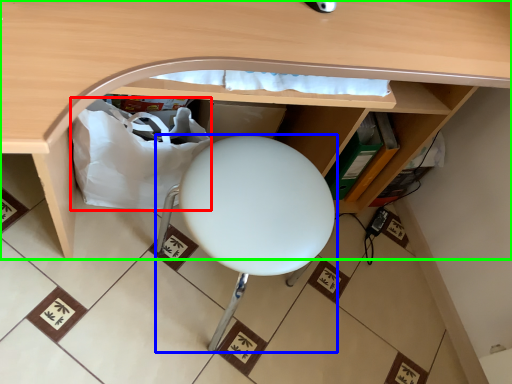
Question: Based on their relative distances, which object is farther from paper bag (highlighted by a red box)? Choose from furniture (highlighted by a blue box) and desk (highlighted by a green box).

Choices:
 (A) furniture
 (B) desk

Answer: (B)